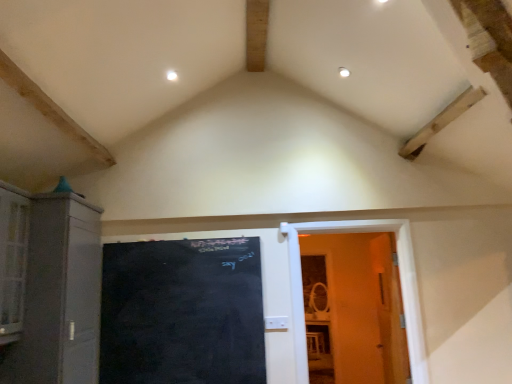
What do you see at coordinates (400, 280) in the screenshot?
I see `wooden door at right` at bounding box center [400, 280].

What is the approximate height of matte gray cabinet at left?

The height of matte gray cabinet at left is 4.23 feet.

The image size is (512, 384). Identify the location of wooden door at right. (400, 280).

Which is closer to the camera, (184,243) or (42,311)?

Point (184,243) appears to be farther away from the viewer than point (42,311).

From the image's perspective, is black chalkboard at center on matte gray cabinet at left?

No, from the image's perspective, black chalkboard at center is not over matte gray cabinet at left.

Based on their positions, is black chalkboard at center located to the left or right of matte gray cabinet at left?

Based on their positions, black chalkboard at center is located to the right of matte gray cabinet at left.

What are the coordinates of `door on the right of matte gray cabinet at left` in the screenshot? It's located at (400, 280).

Is wooden door at right completely or partially inside matte gray cabinet at left?

That's incorrect, wooden door at right is not inside matte gray cabinet at left.

Which of these two, matte gray cabinet at left or wooden door at right, stands taller?

With more height is matte gray cabinet at left.

Is matte gray cabinet at left not near wooden door at right?

Indeed, matte gray cabinet at left is not near wooden door at right.

Is black chalkboard at center located within matte gray cabinet at left?

No, black chalkboard at center is not a part of matte gray cabinet at left.

What's the angular difference between matte gray cabinet at left and black chalkboard at center's facing directions?

The angle between the facing direction of matte gray cabinet at left and the facing direction of black chalkboard at center is 89.8 degrees.

Which point is more distant from viewer, (82, 288) or (234, 309)?

The point (234, 309) is farther.

From the image's perspective, is matte gray cabinet at left positioned above or below black chalkboard at center?

matte gray cabinet at left is situated higher than black chalkboard at center in the image.

Is point (320, 225) closer or farther from the camera than point (138, 361)?

Point (320, 225) is positioned farther from the camera compared to point (138, 361).

Can you see wooden door at right touching black chalkboard at center?

No, wooden door at right is not next to black chalkboard at center.

How different are the orientations of wooden door at right and black chalkboard at center in degrees?

wooden door at right and black chalkboard at center are facing 0.0158 degrees away from each other.

The image size is (512, 384). I want to click on door lying behind the black chalkboard at center, so click(400, 280).

Does wooden door at right lie in front of matte gray cabinet at left?

No, it is behind matte gray cabinet at left.

Considering the positions of points (296, 321) and (87, 231), is point (296, 321) closer to camera compared to point (87, 231)?

No, (296, 321) is behind (87, 231).

In the scene shown: Is matte gray cabinet at left inside wooden door at right?

No, matte gray cabinet at left is not surrounded by wooden door at right.

From the image's perspective, which is above, wooden door at right or matte gray cabinet at left?

matte gray cabinet at left appears higher in the image.

Which is more to the left, black chalkboard at center or wooden door at right?

From the viewer's perspective, black chalkboard at center appears more on the left side.

Is black chalkboard at center aimed at wooden door at right?

No, black chalkboard at center is not oriented towards wooden door at right.

Is black chalkboard at center directly adjacent to wooden door at right?

There is a gap between black chalkboard at center and wooden door at right.

Does point (155, 359) come in front of point (405, 240)?

That is True.

The width and height of the screenshot is (512, 384). What are the coordinates of `cabinetry in front of the black chalkboard at center` in the screenshot? It's located at (60, 295).

At what (x,y) coordinates should I click in order to perform the action: click on door below the matte gray cabinet at left (from a real-world perspective). Please return your answer as a coordinate pair (x, y). The height and width of the screenshot is (384, 512). Looking at the image, I should click on (400, 280).

Estimate the real-world distances between objects in this image. Which object is further from black chalkboard at center, wooden door at right or matte gray cabinet at left?

wooden door at right is further to black chalkboard at center.

Based on their spatial positions, is black chalkboard at center or wooden door at right closer to matte gray cabinet at left?

black chalkboard at center.

Based on their spatial positions, is black chalkboard at center or matte gray cabinet at left closer to wooden door at right?

The object closer to wooden door at right is black chalkboard at center.

Estimate the real-world distances between objects in this image. Which object is further from wooden door at right, matte gray cabinet at left or black chalkboard at center?

Among the two, matte gray cabinet at left is located further to wooden door at right.

Which object lies nearer to the anchor point black chalkboard at center, matte gray cabinet at left or wooden door at right?

The object closer to black chalkboard at center is matte gray cabinet at left.

Based on their spatial positions, is wooden door at right or black chalkboard at center further from matte gray cabinet at left?

wooden door at right is further to matte gray cabinet at left.

Locate an element on the screen. bulletin board located between matte gray cabinet at left and wooden door at right in the left-right direction is located at coordinates (182, 312).